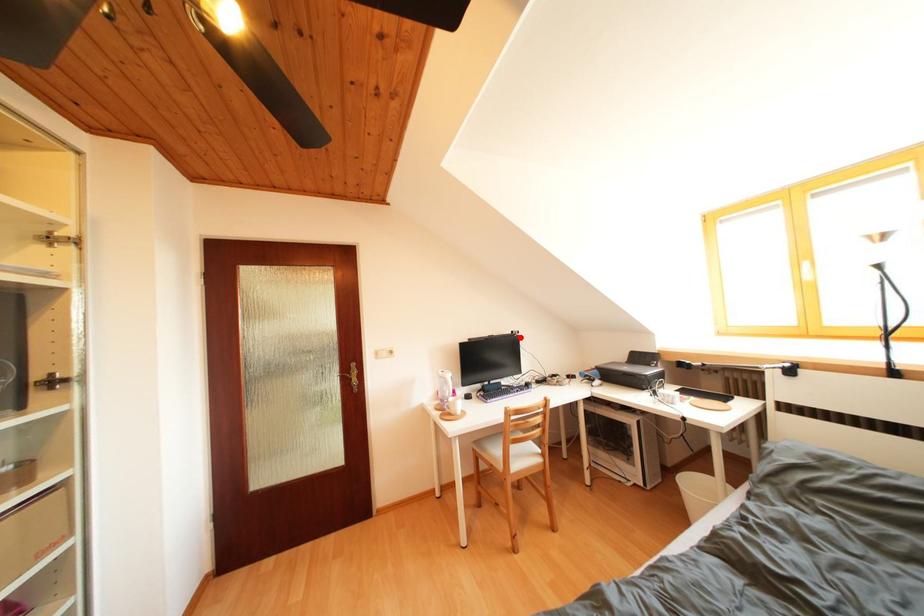
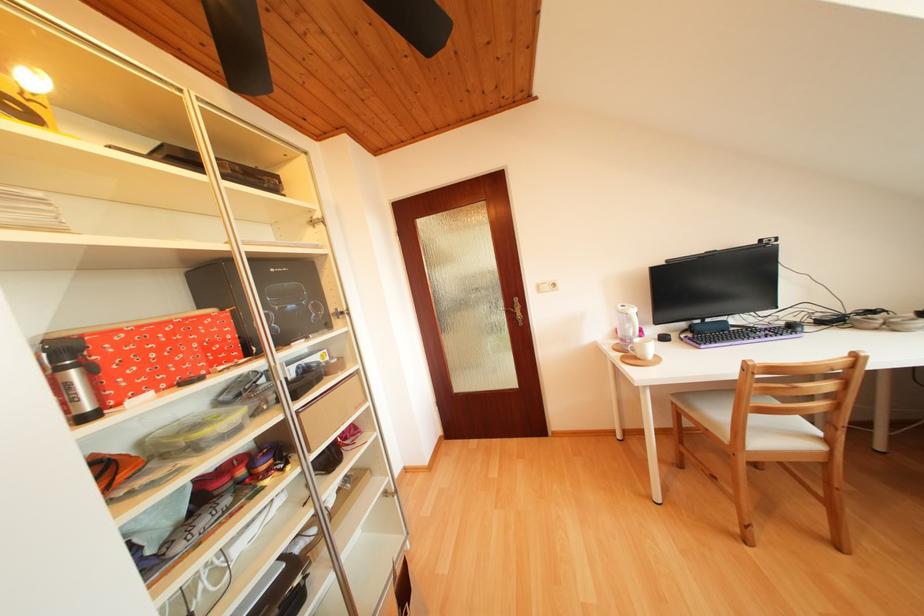
Find the pixel in the second image that matches the highlighted location in the first image.

(769, 246)